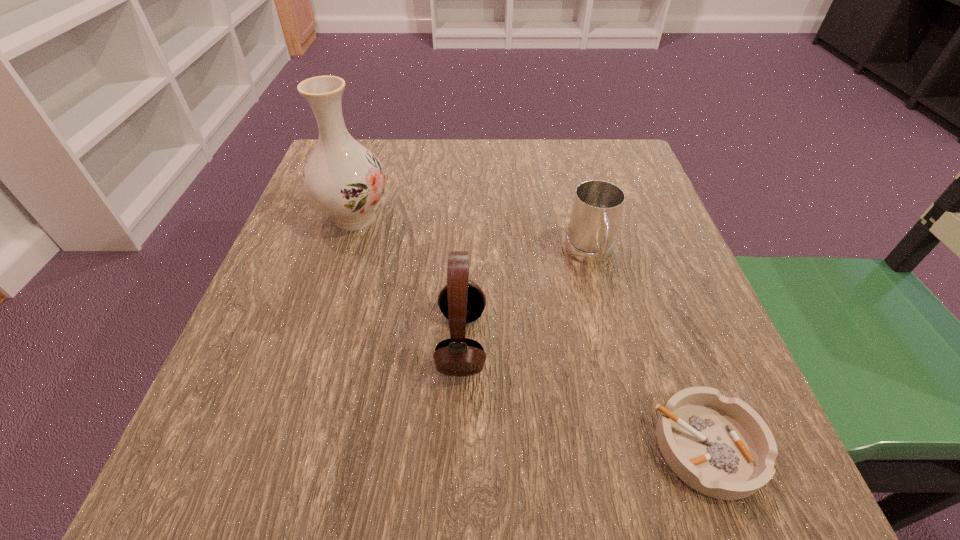
At what (x,y) coordinates should I click in order to perform the action: click on vacant area situated on the back of the ashtray. Please return your answer as a coordinate pair (x, y). This screenshot has height=540, width=960. Looking at the image, I should click on (663, 322).

This screenshot has width=960, height=540. I want to click on object at the near edge, so click(x=721, y=447).

Where is `object located in the left edge section of the desktop`? object located in the left edge section of the desktop is located at coordinates (342, 178).

The height and width of the screenshot is (540, 960). I want to click on mug at the right edge, so click(x=597, y=206).

The image size is (960, 540). Identify the location of ashtray at the right edge. (721, 447).

Where is `object that is positioned at the near right corner`? object that is positioned at the near right corner is located at coordinates (721, 447).

In the image, there is a desktop. Where is `vacant space at the far edge`? vacant space at the far edge is located at coordinates (457, 154).

In the image, there is a desktop. At what (x,y) coordinates should I click in order to perform the action: click on free space at the near edge. Please return your answer as a coordinate pair (x, y). The image size is (960, 540). Looking at the image, I should click on (641, 468).

Find the location of a particular element. The height and width of the screenshot is (540, 960). vacant space at the left edge of the desktop is located at coordinates (366, 237).

The height and width of the screenshot is (540, 960). What are the coordinates of `free space at the right edge of the desktop` in the screenshot? It's located at (641, 226).